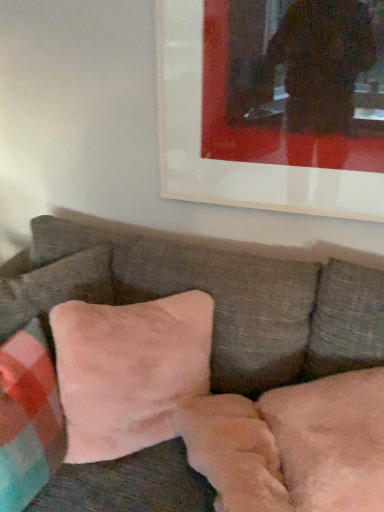
Question: Could you tell me if velvet pink pillow at center is turned towards suede-like beige pillow at lower left, the second pillow from the right?

Choices:
 (A) no
 (B) yes

Answer: (A)

Question: Is the surface of velvet pink pillow at center in direct contact with suede-like beige pillow at lower left, the second pillow from the right?

Choices:
 (A) yes
 (B) no

Answer: (B)

Question: From the image's perspective, is velvet pink pillow at center located above suede-like beige pillow at lower left, the second pillow from the right?

Choices:
 (A) no
 (B) yes

Answer: (A)

Question: From a real-world perspective, is velvet pink pillow at center under suede-like beige pillow at lower left, the second pillow from the right?

Choices:
 (A) yes
 (B) no

Answer: (A)

Question: Is velvet pink pillow at center closer to the viewer compared to suede-like beige pillow at lower left, the second pillow from the right?

Choices:
 (A) yes
 (B) no

Answer: (A)

Question: Would you consider velvet pink pillow at center to be distant from suede-like beige pillow at lower left, the second pillow from the right?

Choices:
 (A) yes
 (B) no

Answer: (B)

Question: Is suede-like pink pillow at center, which appears as the first pillow when viewed from the right, a part of velvet pink pillow at center?

Choices:
 (A) yes
 (B) no

Answer: (A)

Question: Could you tell me if velvet pink pillow at center is facing suede-like pink pillow at center, which appears as the first pillow when viewed from the right?

Choices:
 (A) yes
 (B) no

Answer: (A)

Question: Does velvet pink pillow at center have a lesser height compared to suede-like pink pillow at center, arranged as the third pillow when viewed from the left?

Choices:
 (A) yes
 (B) no

Answer: (B)

Question: Considering the relative sizes of velvet pink pillow at center and suede-like pink pillow at center, which appears as the first pillow when viewed from the right, in the image provided, is velvet pink pillow at center smaller than suede-like pink pillow at center, which appears as the first pillow when viewed from the right,?

Choices:
 (A) no
 (B) yes

Answer: (A)

Question: Considering the relative sizes of velvet pink pillow at center and suede-like pink pillow at center, arranged as the third pillow when viewed from the left, in the image provided, is velvet pink pillow at center thinner than suede-like pink pillow at center, arranged as the third pillow when viewed from the left,?

Choices:
 (A) yes
 (B) no

Answer: (B)

Question: Is velvet pink pillow at center positioned with its back to suede-like pink pillow at center, which appears as the first pillow when viewed from the right?

Choices:
 (A) no
 (B) yes

Answer: (B)

Question: Would you say velvet pink pillow at center is part of velvet pink pillow at center, the third pillow from the right,'s contents?

Choices:
 (A) no
 (B) yes

Answer: (A)